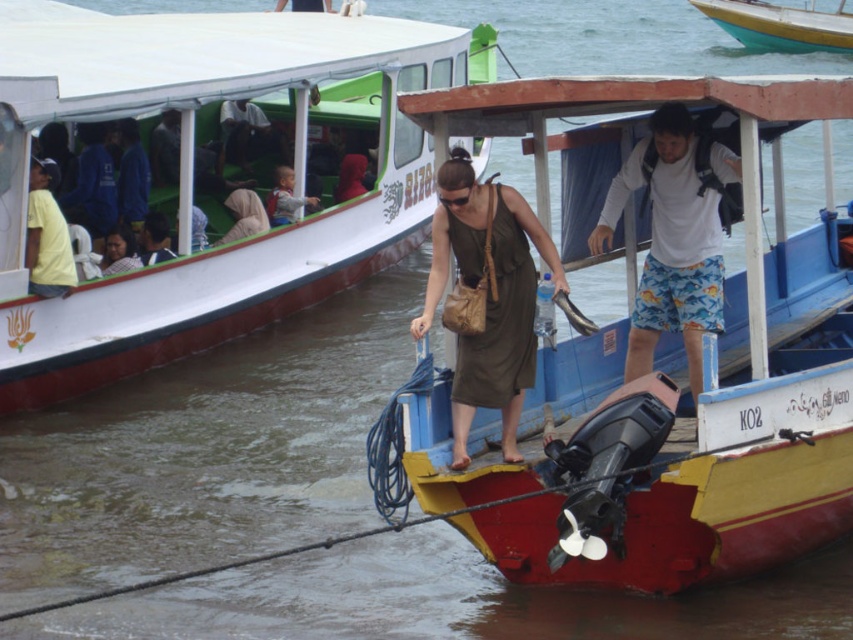
Is yellow matte shirt at left bigger than light brown backpack at upper left?

Actually, yellow matte shirt at left might be smaller than light brown backpack at upper left.

Who is taller, yellow matte shirt at left or light brown backpack at upper left?

yellow matte shirt at left is taller.

The width and height of the screenshot is (853, 640). I want to click on yellow matte shirt at left, so [47, 236].

Find the location of `yellow matte shirt at left`. yellow matte shirt at left is located at coordinates (47, 236).

Is light brown fabric headscarf at upper left bigger than dark brown leather jacket at upper center?

Incorrect, light brown fabric headscarf at upper left is not larger than dark brown leather jacket at upper center.

Which of these two, light brown fabric headscarf at upper left or dark brown leather jacket at upper center, stands taller?

With more height is light brown fabric headscarf at upper left.

Does point (111, 272) come closer to viewer compared to point (312, 8)?

Yes, it is in front of point (312, 8).

The width and height of the screenshot is (853, 640). I want to click on light brown fabric headscarf at upper left, so click(119, 252).

Is point (154, 48) positioned after point (289, 170)?

No.

Does wooden boat at center have a lesser height compared to light brown backpack at upper left?

No.

Is point (279, 104) positioned in front of point (277, 220)?

No, it is not.

What are the coordinates of `wooden boat at center` in the screenshot? It's located at (198, 172).